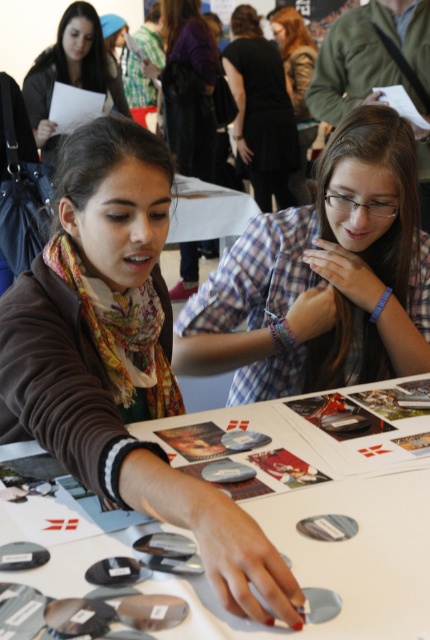
Is matte scarf at center further to camera compared to black dress at center?

No, matte scarf at center is in front of black dress at center.

Describe the element at coordinates (192, 88) in the screenshot. The width and height of the screenshot is (430, 640). I see `matte scarf at center` at that location.

Where is `matte scarf at center`? matte scarf at center is located at coordinates (192, 88).

How far apart are matte black jacket at upper left and camouflage-patterned shirt at center?

A distance of 5.77 feet exists between matte black jacket at upper left and camouflage-patterned shirt at center.

Is matte black jacket at upper left above camouflage-patterned shirt at center?

Incorrect, matte black jacket at upper left is not positioned above camouflage-patterned shirt at center.

Which is in front, point (55, 56) or point (301, 161)?

Positioned in front is point (55, 56).

The height and width of the screenshot is (640, 430). I want to click on matte black jacket at upper left, so click(x=70, y=72).

Is plaid shirt at center further to the viewer compared to matte black jacket at upper left?

No, it is in front of matte black jacket at upper left.

Does plaid shirt at center have a greater width compared to matte black jacket at upper left?

Yes.

Is point (399, 179) less distant than point (34, 64)?

Yes, it is in front of point (34, 64).

In order to click on plaid shirt at center in this screenshot , I will do `click(322, 278)`.